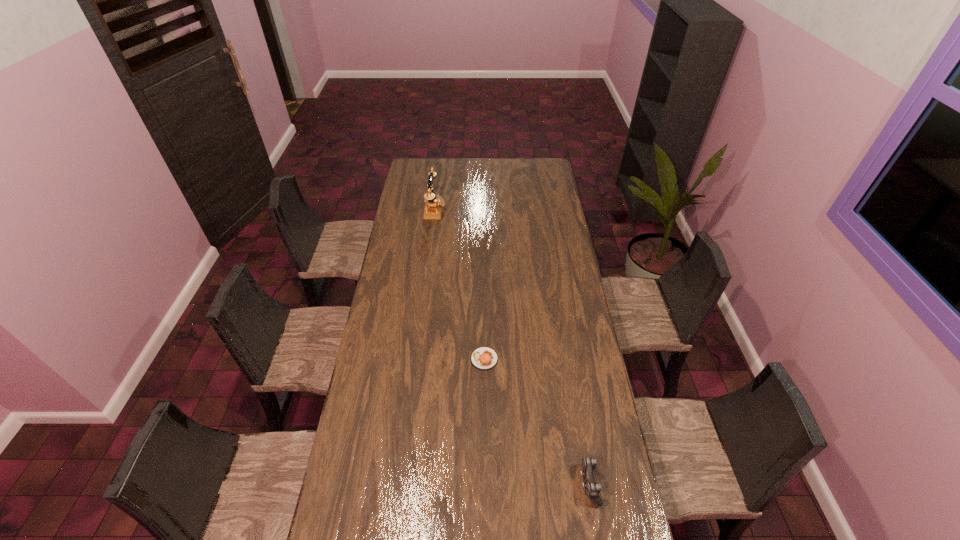
The image size is (960, 540). In order to click on free space located on the left of the second nearest object in this screenshot , I will do `click(394, 359)`.

Where is `object that is at the left edge`? Image resolution: width=960 pixels, height=540 pixels. object that is at the left edge is located at coordinates (433, 206).

Where is `object at the right edge`? The image size is (960, 540). object at the right edge is located at coordinates (592, 488).

At what (x,y) coordinates should I click in order to perform the action: click on vacant point at the far edge. Please return your answer as a coordinate pair (x, y). Looking at the image, I should click on (450, 168).

Find the location of a particular element. vacant space at the left edge is located at coordinates (395, 261).

This screenshot has width=960, height=540. Identify the location of free space at the right edge. (565, 237).

In the image, there is a desktop. Where is `vacant space at the far left corner`? This screenshot has width=960, height=540. vacant space at the far left corner is located at coordinates (419, 171).

Find the location of `empty location between the tallest object and the control`. empty location between the tallest object and the control is located at coordinates (512, 347).

Image resolution: width=960 pixels, height=540 pixels. Identify the location of vacant space that is in between the second nearest object and the leftmost object. point(460,285).

Locate an element on the screen. This screenshot has width=960, height=540. empty location between the second farthest object and the nearest object is located at coordinates (537, 422).